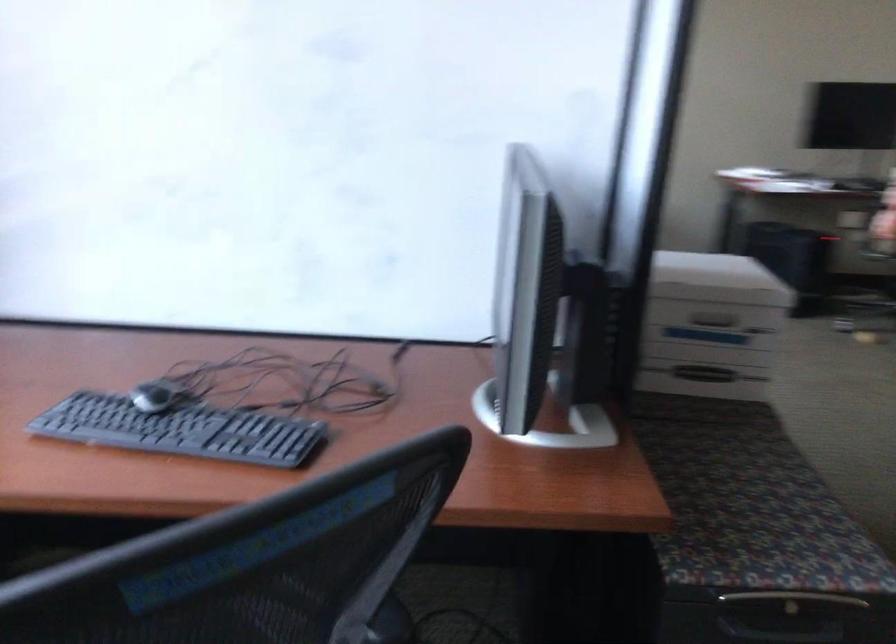
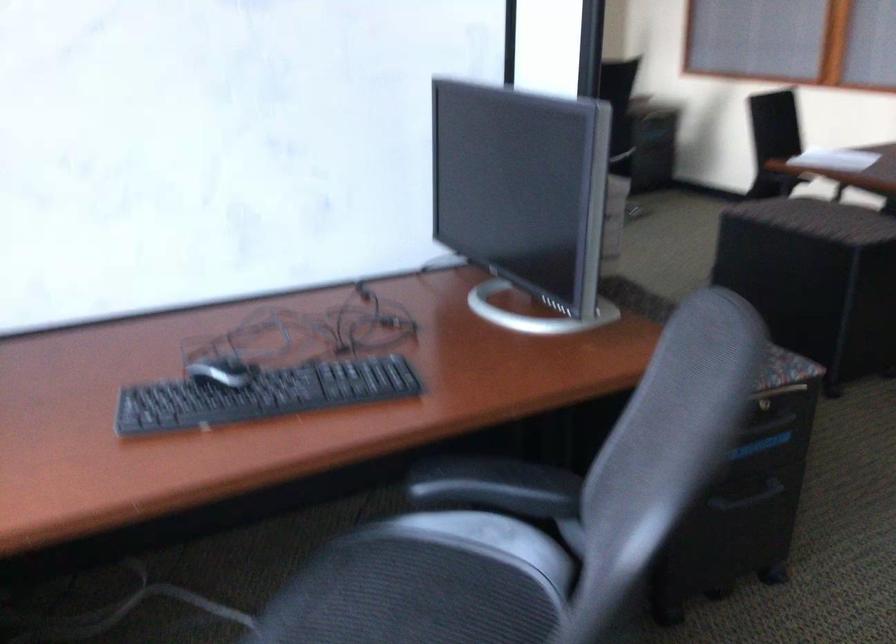
Question: The camera is either moving clockwise (left) or counter-clockwise (right) around the object. The first image is from the beginning of the video and the second image is from the end. Is the camera moving left or right when shooting the video?

Choices:
 (A) Left
 (B) Right

Answer: (A)